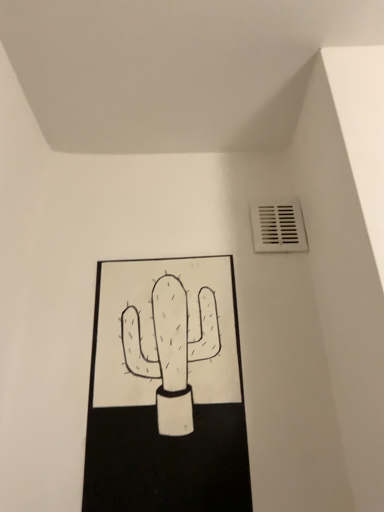
Question: Considering the positions of white plastic vent at upper right and white matte cactus at center in the image, is white plastic vent at upper right wider or thinner than white matte cactus at center?

Choices:
 (A) thin
 (B) wide

Answer: (A)

Question: Is white plastic vent at upper right situated inside white matte cactus at center or outside?

Choices:
 (A) inside
 (B) outside

Answer: (B)

Question: Relative to white matte cactus at center, is white plastic vent at upper right in front or behind?

Choices:
 (A) front
 (B) behind

Answer: (B)

Question: From a real-world perspective, is white matte cactus at center physically located above or below white plastic vent at upper right?

Choices:
 (A) above
 (B) below

Answer: (B)

Question: Is white matte cactus at center to the left or to the right of white plastic vent at upper right in the image?

Choices:
 (A) left
 (B) right

Answer: (A)

Question: In the image, is white matte cactus at center positioned in front of or behind white plastic vent at upper right?

Choices:
 (A) behind
 (B) front

Answer: (B)

Question: Is white matte cactus at center inside the boundaries of white plastic vent at upper right, or outside?

Choices:
 (A) outside
 (B) inside

Answer: (A)